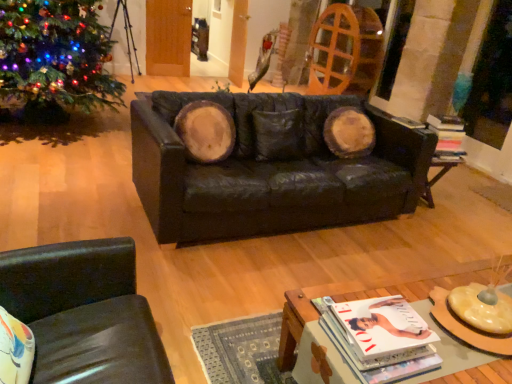
Question: Is matte white magazine at lower center, marked as the first magazine in a front-to-back arrangement, turned away from green matte christmas tree at left?

Choices:
 (A) no
 (B) yes

Answer: (A)

Question: Could you tell me if matte white magazine at lower center, the second magazine viewed from the back, is turned towards green matte christmas tree at left?

Choices:
 (A) no
 (B) yes

Answer: (B)

Question: Considering the relative sizes of matte white magazine at lower center, the second magazine positioned from the right, and green matte christmas tree at left in the image provided, is matte white magazine at lower center, the second magazine positioned from the right, wider than green matte christmas tree at left?

Choices:
 (A) no
 (B) yes

Answer: (A)

Question: Is matte white magazine at lower center, the second magazine positioned from the right, smaller than green matte christmas tree at left?

Choices:
 (A) no
 (B) yes

Answer: (B)

Question: Is matte white magazine at lower center, arranged as the first magazine when ordered from the bottom, positioned before green matte christmas tree at left?

Choices:
 (A) no
 (B) yes

Answer: (B)

Question: From a real-world perspective, is matte white magazine at lower center, arranged as the first magazine when ordered from the bottom, over green matte christmas tree at left?

Choices:
 (A) yes
 (B) no

Answer: (B)

Question: Can we say black leather couch at center lies outside wooden coffee table at lower center?

Choices:
 (A) no
 (B) yes

Answer: (B)

Question: Is black leather couch at center further to camera compared to wooden coffee table at lower center?

Choices:
 (A) yes
 (B) no

Answer: (A)

Question: Is black leather couch at center not near wooden coffee table at lower center?

Choices:
 (A) yes
 (B) no

Answer: (A)

Question: From a real-world perspective, is black leather couch at center positioned under wooden coffee table at lower center based on gravity?

Choices:
 (A) no
 (B) yes

Answer: (A)

Question: Is black leather couch at center thinner than wooden coffee table at lower center?

Choices:
 (A) no
 (B) yes

Answer: (A)

Question: Could wooden coffee table at lower center be considered to be inside black leather couch at center?

Choices:
 (A) no
 (B) yes

Answer: (A)

Question: Considering the relative positions of black leather couch at center and green matte christmas tree at left in the image provided, is black leather couch at center to the right of green matte christmas tree at left from the viewer's perspective?

Choices:
 (A) yes
 (B) no

Answer: (A)